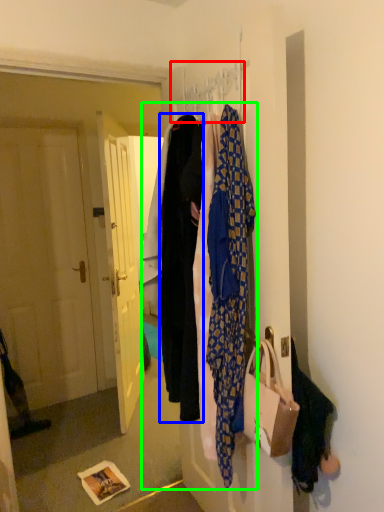
Question: Which is farther away from hanger (highlighted by a red box)? garment (highlighted by a blue box) or closet (highlighted by a green box)?

Choices:
 (A) garment
 (B) closet

Answer: (B)